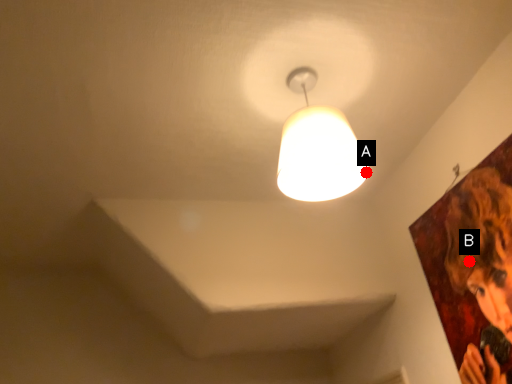
Question: Two points are circled on the image, labeled by A and B beside each circle. Which point appears closest to the camera in this image?

Choices:
 (A) A is closer
 (B) B is closer

Answer: (A)